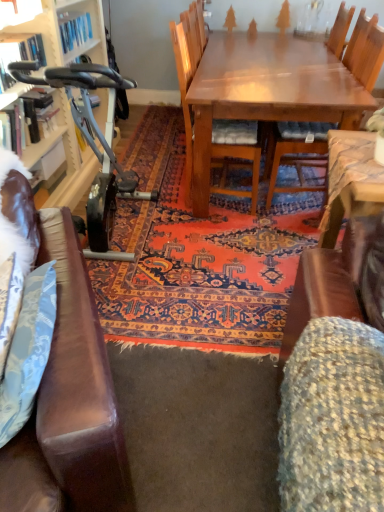
Question: Is metallic blue exercise bike at left to the right of wooden chair at center, which is counted as the first chair, starting from the left, from the viewer's perspective?

Choices:
 (A) no
 (B) yes

Answer: (A)

Question: Can wooden chair at center, which is counted as the first chair, starting from the left, be found inside metallic blue exercise bike at left?

Choices:
 (A) yes
 (B) no

Answer: (B)

Question: Is metallic blue exercise bike at left bigger than wooden chair at center, which is counted as the first chair, starting from the left?

Choices:
 (A) yes
 (B) no

Answer: (A)

Question: Is metallic blue exercise bike at left looking in the opposite direction of wooden chair at center, which is the second chair from right to left?

Choices:
 (A) yes
 (B) no

Answer: (B)

Question: Does metallic blue exercise bike at left have a greater height compared to wooden chair at center, which is the second chair from right to left?

Choices:
 (A) yes
 (B) no

Answer: (B)

Question: From a real-world perspective, does metallic blue exercise bike at left stand above wooden chair at center, which is counted as the first chair, starting from the left?

Choices:
 (A) no
 (B) yes

Answer: (A)

Question: Could metallic blue exercise bike at left be considered to be inside wooden chair at center, positioned as the 2th chair in left-to-right order?

Choices:
 (A) no
 (B) yes

Answer: (A)

Question: Does wooden chair at center, which is counted as the 1th chair, starting from the right, have a smaller size compared to metallic blue exercise bike at left?

Choices:
 (A) no
 (B) yes

Answer: (B)

Question: Is wooden chair at center, positioned as the 2th chair in left-to-right order, aimed at metallic blue exercise bike at left?

Choices:
 (A) no
 (B) yes

Answer: (A)

Question: From a real-world perspective, is wooden chair at center, which is counted as the 1th chair, starting from the right, below metallic blue exercise bike at left?

Choices:
 (A) no
 (B) yes

Answer: (A)

Question: Can you confirm if wooden chair at center, positioned as the 2th chair in left-to-right order, is positioned to the right of metallic blue exercise bike at left?

Choices:
 (A) no
 (B) yes

Answer: (B)

Question: Does wooden chair at center, positioned as the 2th chair in left-to-right order, have a larger size compared to metallic blue exercise bike at left?

Choices:
 (A) yes
 (B) no

Answer: (B)

Question: Is fluffy fabric swivel chair at lower right thinner than metallic blue exercise bike at left?

Choices:
 (A) yes
 (B) no

Answer: (B)